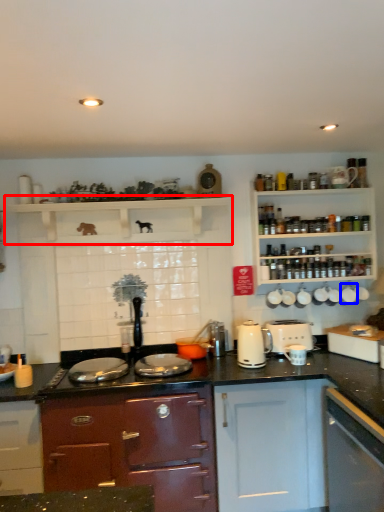
Question: Which object is closer to the camera taking this photo, shelf (highlighted by a red box) or appliance (highlighted by a blue box)?

Choices:
 (A) shelf
 (B) appliance

Answer: (A)